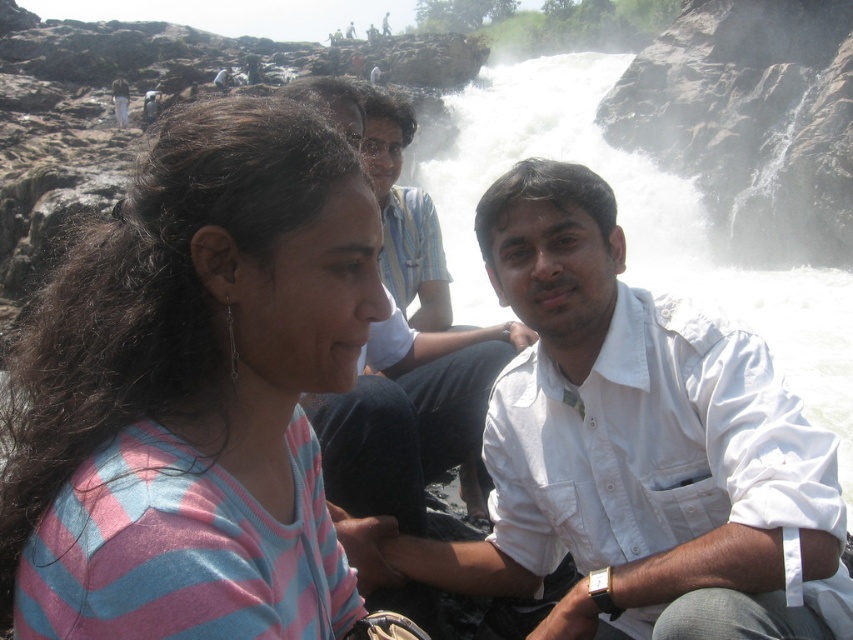
Question: Is white cotton shirt at center to the right of white shirt at center from the viewer's perspective?

Choices:
 (A) yes
 (B) no

Answer: (A)

Question: Estimate the real-world distances between objects in this image. Which object is closer to the white cotton shirt at center?

Choices:
 (A) pink striped sweater at left
 (B) white shirt at center

Answer: (B)

Question: Is pink striped sweater at left below white shirt at center?

Choices:
 (A) no
 (B) yes

Answer: (B)

Question: Estimate the real-world distances between objects in this image. Which object is closer to the white cotton shirt at center?

Choices:
 (A) white shirt at center
 (B) pink striped sweater at left

Answer: (A)

Question: Does white cotton shirt at center have a smaller size compared to white shirt at center?

Choices:
 (A) no
 (B) yes

Answer: (B)

Question: Which point is farther to the camera?

Choices:
 (A) (254, 360)
 (B) (387, 444)

Answer: (B)